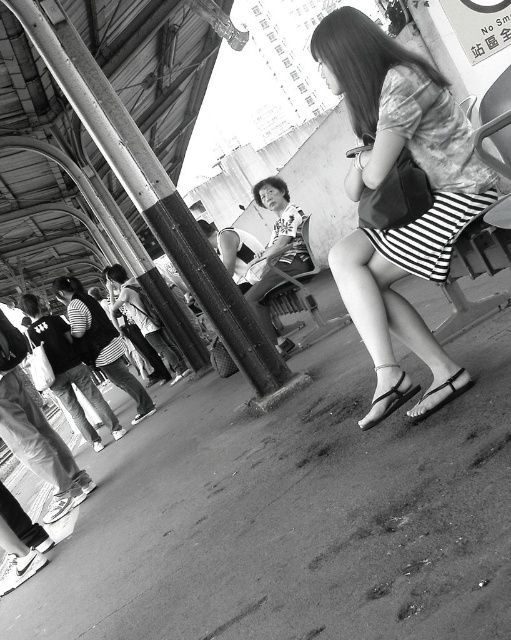
You are a photographer trying to capture both the black leather sandal at lower center and the metallic silver sandal at lower center in the same frame. Based on their positions, which sandal should you adjust your camera angle to focus on first to ensure both are in the shot?

The black leather sandal at lower center is to the left of the metallic silver sandal at lower center, so you should focus on the black leather sandal at lower center first to ensure both are included in the frame.

Based on the photo, you are a photographer adjusting your camera settings. You notice the matte striped skirt at center and the metallic silver sandal at lower center in your frame. Which object should you focus on if you want to capture the one that is higher in the image?

The matte striped skirt at center is taller than the metallic silver sandal at lower center, so you should focus on the matte striped skirt at center to capture the higher object.

You are a photographer trying to capture a detailed shot of both the black leather sandal at lower center and the metallic silver sandal at lower center. Since you want to ensure both are in focus, you need to know which sandal is closer to the camera. Can you determine which one is closer?

The black leather sandal at lower center is thinner than metallic silver sandal at lower center, but the description does not provide information about their distance from the camera. Therefore, it is impossible to determine which sandal is closer based on the given details.